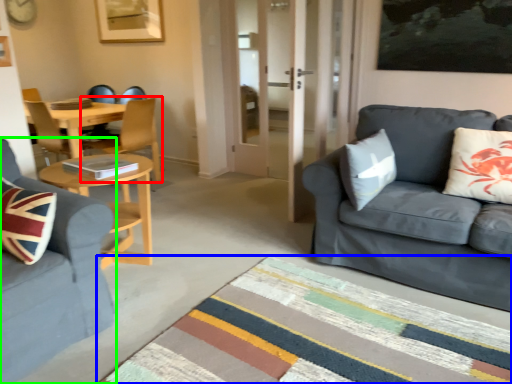
Question: Considering the real-world distances, which object is farthest from chair (highlighted by a red box)? plain (highlighted by a blue box) or studio couch (highlighted by a green box)?

Choices:
 (A) plain
 (B) studio couch

Answer: (A)